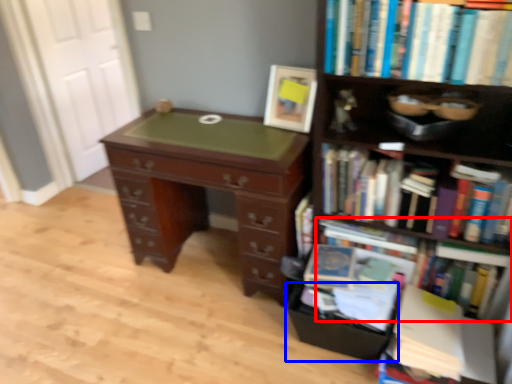
Question: Among these objects, which one is nearest to the camera, book (highlighted by a red box) or drawer (highlighted by a blue box)?

Choices:
 (A) book
 (B) drawer

Answer: (A)